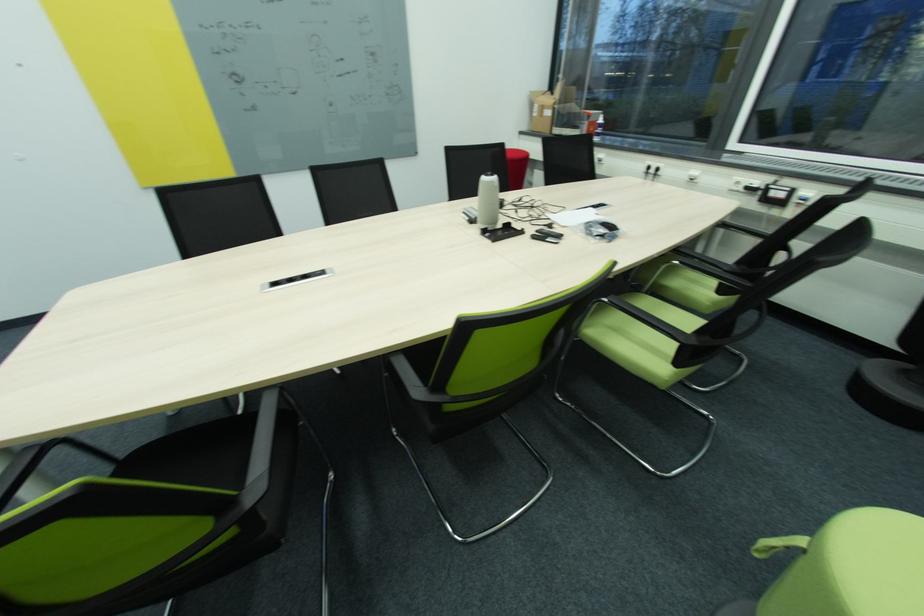
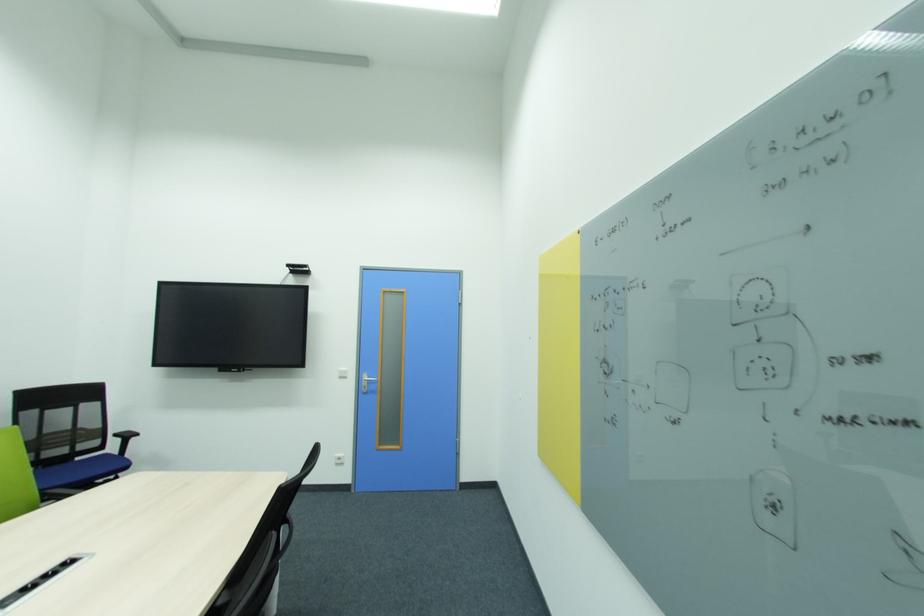
The point at (238, 75) is marked in the first image. Where is the corresponding point in the second image?

(610, 362)